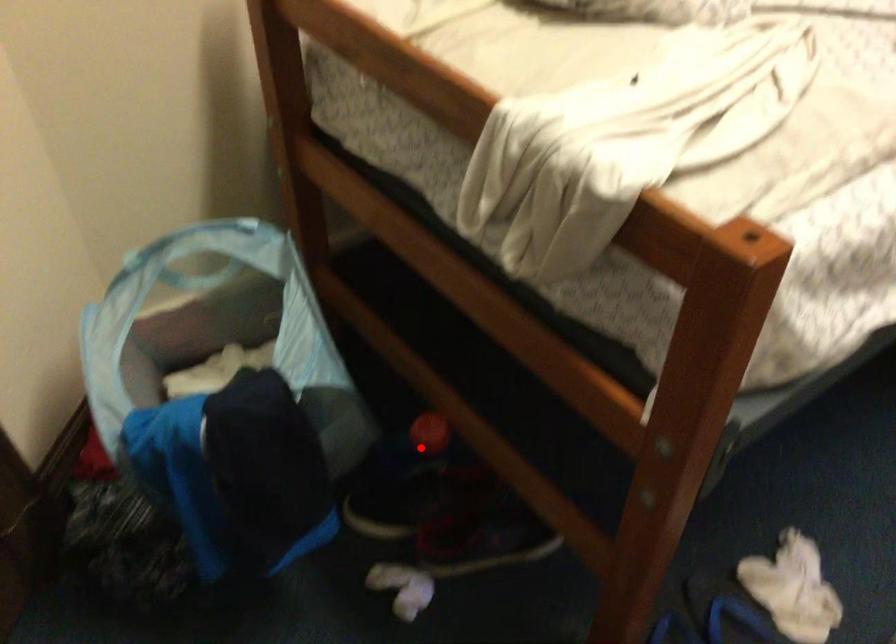
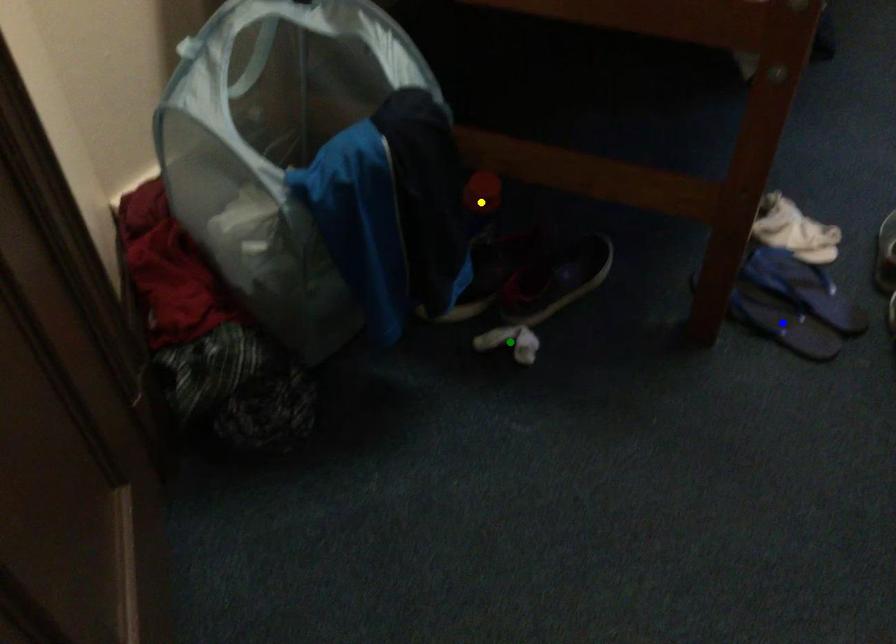
Question: I am providing you with two images of the same scene from different viewpoints. A red point is marked on the first image. You are given multiple points on the second image. Which mark in image 2 goes with the point in image 1?

Choices:
 (A) yellow point
 (B) blue point
 (C) green point

Answer: (A)